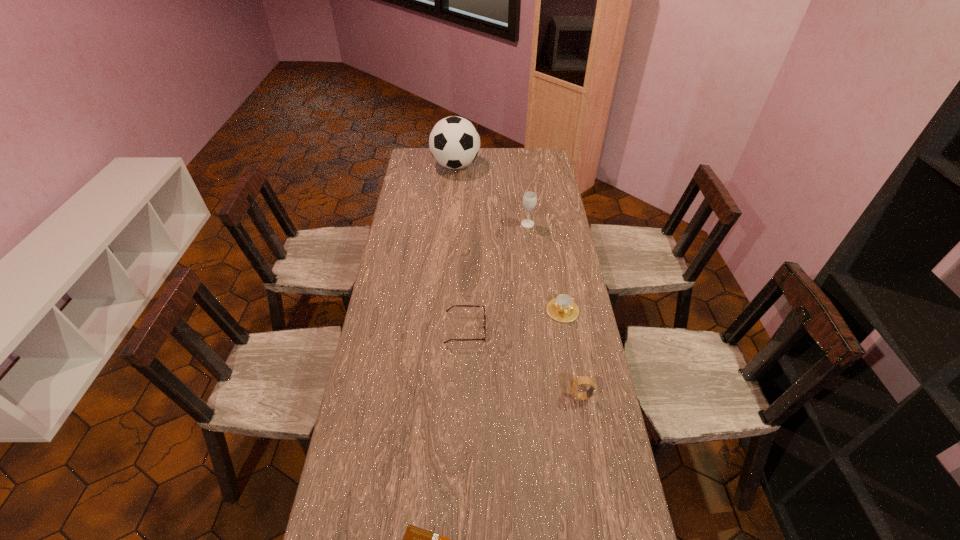
You are a GUI agent. You are given a task and a screenshot of the screen. Output one action in this format:
    pyautogui.click(x=<x>, y=<y>)
    Task: Click on the tallest object
    The width and height of the screenshot is (960, 540).
    Given the screenshot: What is the action you would take?
    pyautogui.click(x=454, y=142)

Image resolution: width=960 pixels, height=540 pixels. Find the location of `soccer ball`. soccer ball is located at coordinates (454, 142).

Find the location of a particular element. the second tallest object is located at coordinates (529, 199).

Identify the location of wineglass. (529, 199).

Image resolution: width=960 pixels, height=540 pixels. I want to click on watch, so click(x=575, y=383).

Where is `the second nearest object`? The image size is (960, 540). the second nearest object is located at coordinates (575, 383).

This screenshot has width=960, height=540. What are the coordinates of `the fourth tallest object` in the screenshot? It's located at (563, 309).

Locate an element on the screen. This screenshot has width=960, height=540. spectacles is located at coordinates (484, 323).

The height and width of the screenshot is (540, 960). Identify the location of free space located on the front of the tallest object. (452, 217).

You are a GUI agent. You are given a task and a screenshot of the screen. Output one action in this format:
    pyautogui.click(x=<x>, y=<y>)
    Task: Click on the vacant space located 0.290m on the left of the fourth object from left to right
    
    Given the screenshot: What is the action you would take?
    pyautogui.click(x=457, y=225)